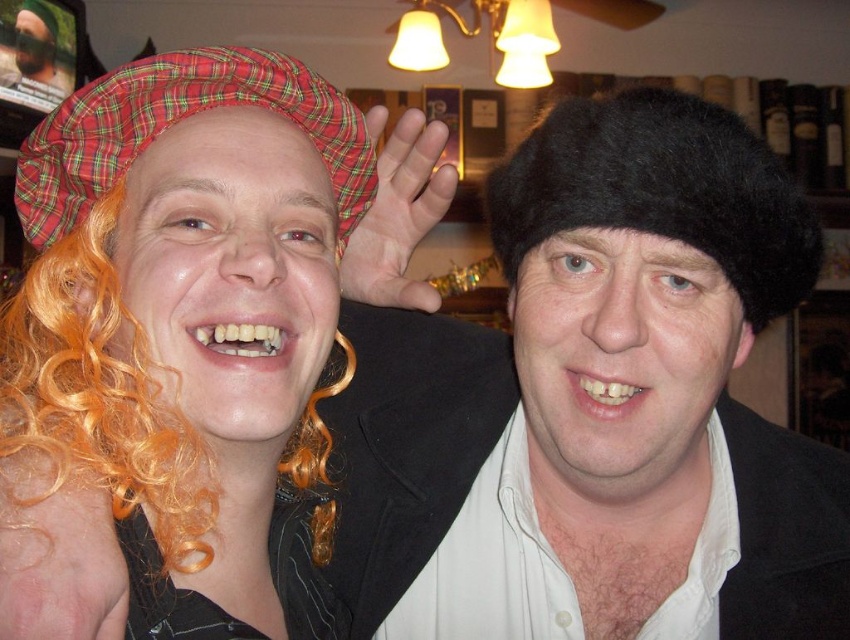
Question: Which point appears farthest from the camera in this image?

Choices:
 (A) (599, 170)
 (B) (100, 196)
 (C) (60, 177)

Answer: (C)

Question: Can you confirm if black fuzzy hat at upper right is wider than plaid fabric hat at upper left?

Choices:
 (A) yes
 (B) no

Answer: (B)

Question: Which is farther from the orange curly wig at left?

Choices:
 (A) black fuzzy hat at upper right
 (B) plaid fabric hat at upper left

Answer: (A)

Question: Does black fuzzy hat at upper right come behind plaid fabric hat at upper left?

Choices:
 (A) yes
 (B) no

Answer: (B)

Question: Does black fuzzy hat at upper right have a smaller size compared to plaid fabric hat at upper left?

Choices:
 (A) yes
 (B) no

Answer: (B)

Question: Which point appears farthest from the camera in this image?

Choices:
 (A) (35, 260)
 (B) (187, 81)

Answer: (A)